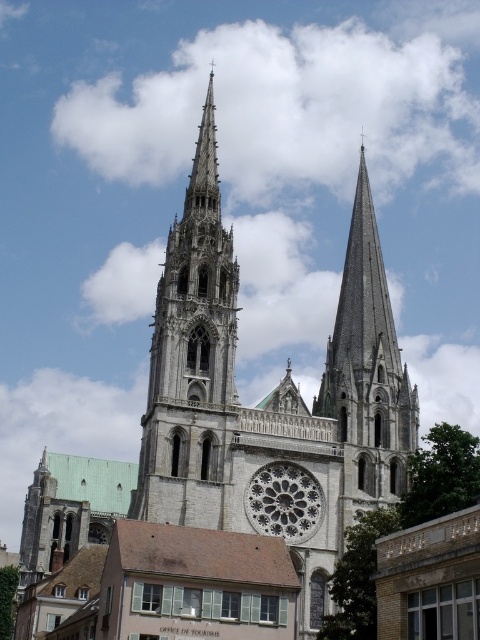
Question: Can you confirm if stone gothic cathedral spire at center is positioned below gray stone spire at center?

Choices:
 (A) yes
 (B) no

Answer: (B)

Question: Estimate the real-world distances between objects in this image. Which object is farther from the gray stone spire at center?

Choices:
 (A) white stone rose window at center
 (B) white fluffy cloud at upper center

Answer: (B)

Question: Which of the following is the closest to the observer?

Choices:
 (A) (224, 333)
 (B) (111, 170)
 (C) (252, 481)
 (D) (382, 486)

Answer: (C)

Question: Is stone gothic cathedral spire at center to the right of white stone rose window at center from the viewer's perspective?

Choices:
 (A) no
 (B) yes

Answer: (A)

Question: Among these objects, which one is nearest to the camera?

Choices:
 (A) gray stone spire at center
 (B) white stone rose window at center

Answer: (A)

Question: Considering the relative positions of white fluffy cloud at upper center and stone gothic cathedral spire at center in the image provided, where is white fluffy cloud at upper center located with respect to stone gothic cathedral spire at center?

Choices:
 (A) above
 (B) below

Answer: (A)